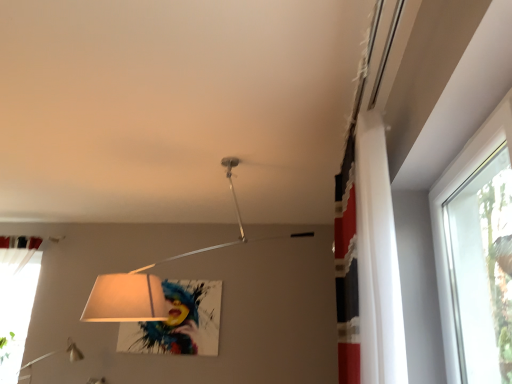
Question: Considering the relative positions of transparent glass window at upper right and matte white lampshade at center in the image provided, is transparent glass window at upper right to the left of matte white lampshade at center from the viewer's perspective?

Choices:
 (A) no
 (B) yes

Answer: (A)

Question: Can you confirm if transparent glass window at upper right is shorter than matte white lampshade at center?

Choices:
 (A) no
 (B) yes

Answer: (B)

Question: Is transparent glass window at upper right positioned in front of matte white lampshade at center?

Choices:
 (A) no
 (B) yes

Answer: (B)

Question: From the image's perspective, is transparent glass window at upper right under matte white lampshade at center?

Choices:
 (A) no
 (B) yes

Answer: (B)

Question: From the image's perspective, does transparent glass window at upper right appear higher than matte white lampshade at center?

Choices:
 (A) yes
 (B) no

Answer: (B)

Question: Does transparent glass window at upper right have a lesser width compared to matte white lampshade at center?

Choices:
 (A) no
 (B) yes

Answer: (B)

Question: Considering the relative sizes of matte white lampshade at center and transparent glass window at upper right in the image provided, is matte white lampshade at center smaller than transparent glass window at upper right?

Choices:
 (A) no
 (B) yes

Answer: (A)

Question: Can you confirm if matte white lampshade at center is taller than transparent glass window at upper right?

Choices:
 (A) no
 (B) yes

Answer: (B)

Question: Does matte white lampshade at center have a larger size compared to transparent glass window at upper right?

Choices:
 (A) no
 (B) yes

Answer: (B)

Question: From a real-world perspective, is matte white lampshade at center located higher than transparent glass window at upper right?

Choices:
 (A) no
 (B) yes

Answer: (B)

Question: Is matte white lampshade at center not inside transparent glass window at upper right?

Choices:
 (A) yes
 (B) no

Answer: (A)

Question: Are matte white lampshade at center and transparent glass window at upper right far apart?

Choices:
 (A) yes
 (B) no

Answer: (A)

Question: Is white fabric curtain at upper right, arranged as the 1th curtain when viewed from the front, at the left side of matte white lampshade at center?

Choices:
 (A) no
 (B) yes

Answer: (A)